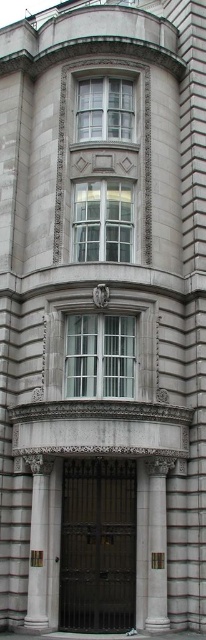
You are a visitor approaching the grand classical building. You see the dark brown metal gate at center and the satin gold metal at center. Which one do you think is bigger in size?

The dark brown metal gate at center is larger in size than the satin gold metal at center, so the dark brown metal gate at center is bigger.

You are a construction worker standing at the dark brown metal gate at center. You need to place a new camera exactly 43.25 meters away from the gate. Based on the scene, where would you position the camera?

The camera should be placed exactly 43.25 meters away from the dark brown metal gate at center, as specified in the description.